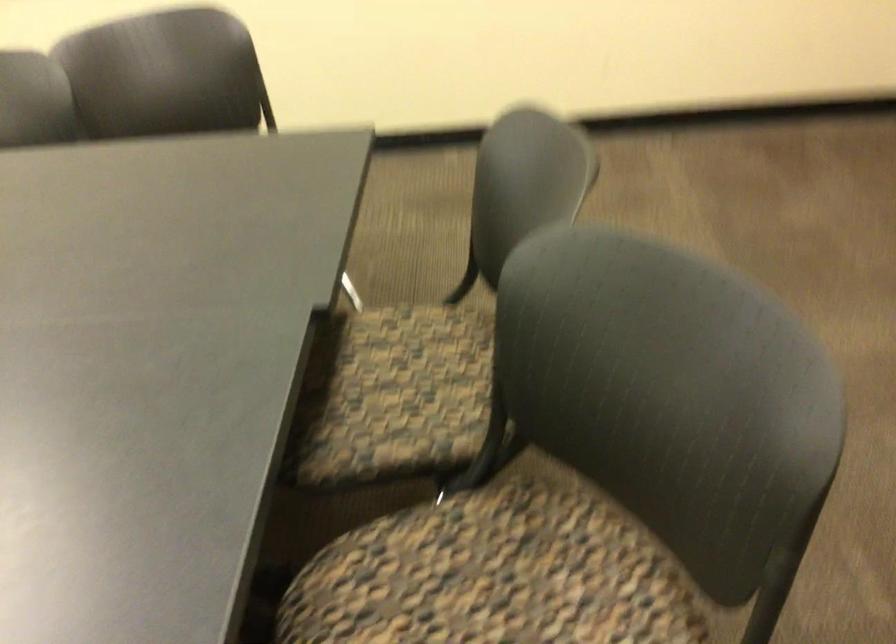
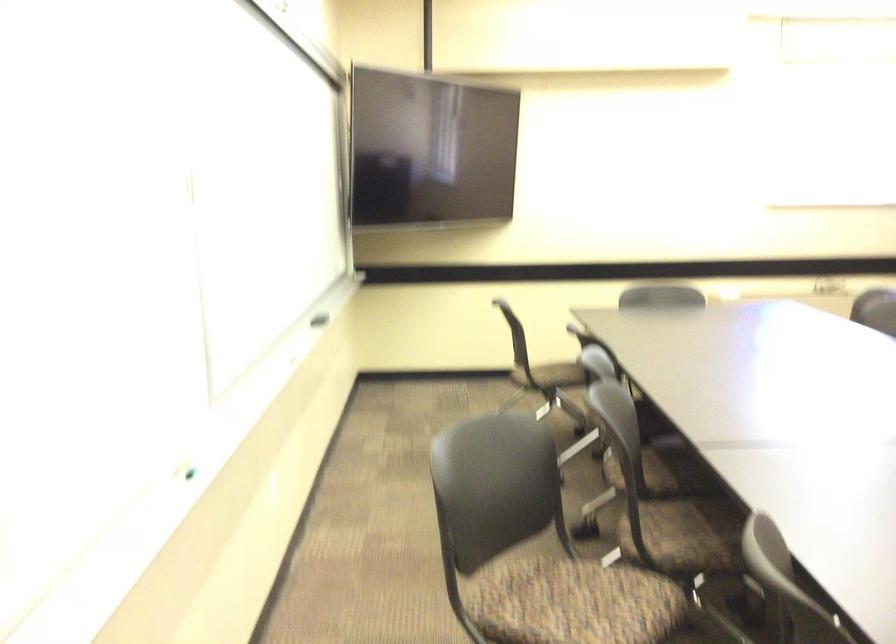
Question: The images are taken continuously from a first-person perspective. In which direction is your viewpoint rotating?

Choices:
 (A) Left
 (B) Right
 (C) Up
 (D) Down

Answer: (A)